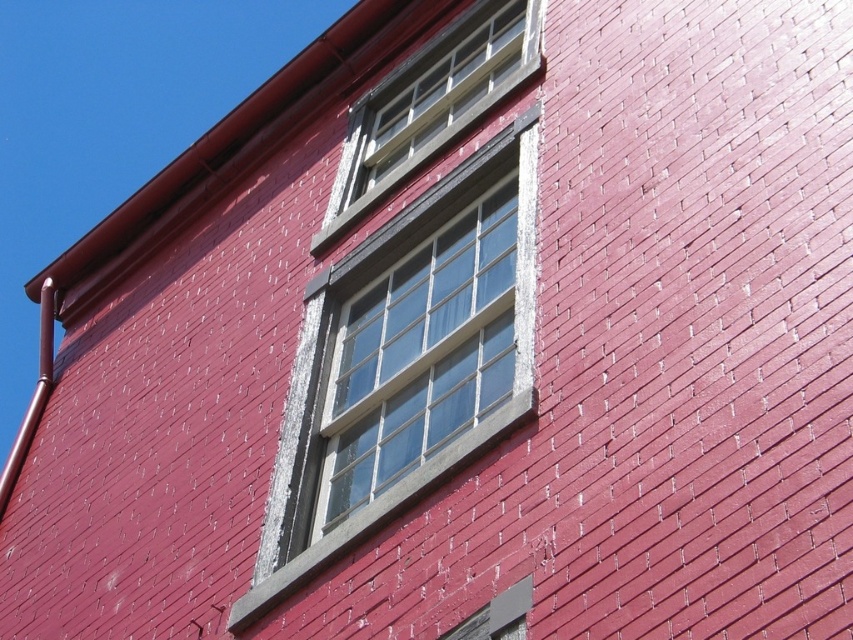
Does clear glass window at center appear over clear glass window at upper center?

No, clear glass window at center is not above clear glass window at upper center.

Can you confirm if clear glass window at center is positioned to the right of clear glass window at upper center?

No, clear glass window at center is not to the right of clear glass window at upper center.

The image size is (853, 640). I want to click on clear glass window at center, so click(x=415, y=342).